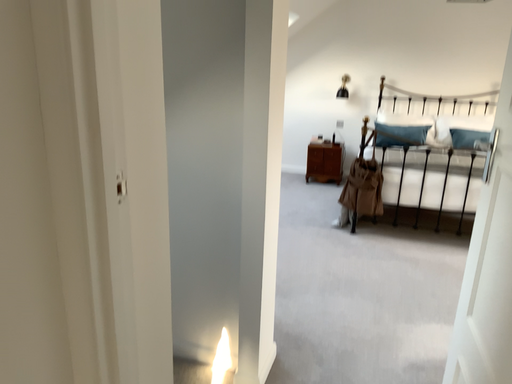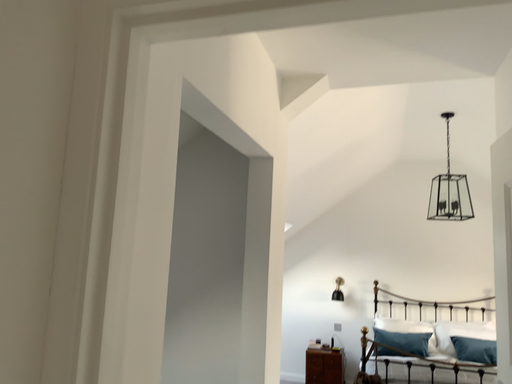
Question: How did the camera likely rotate when shooting the video?

Choices:
 (A) rotated downward
 (B) rotated upward

Answer: (B)